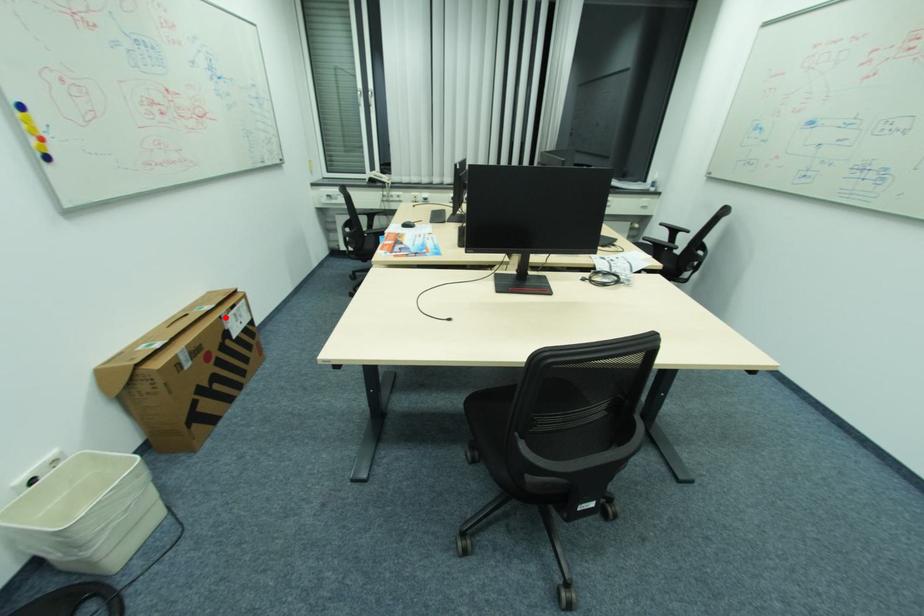
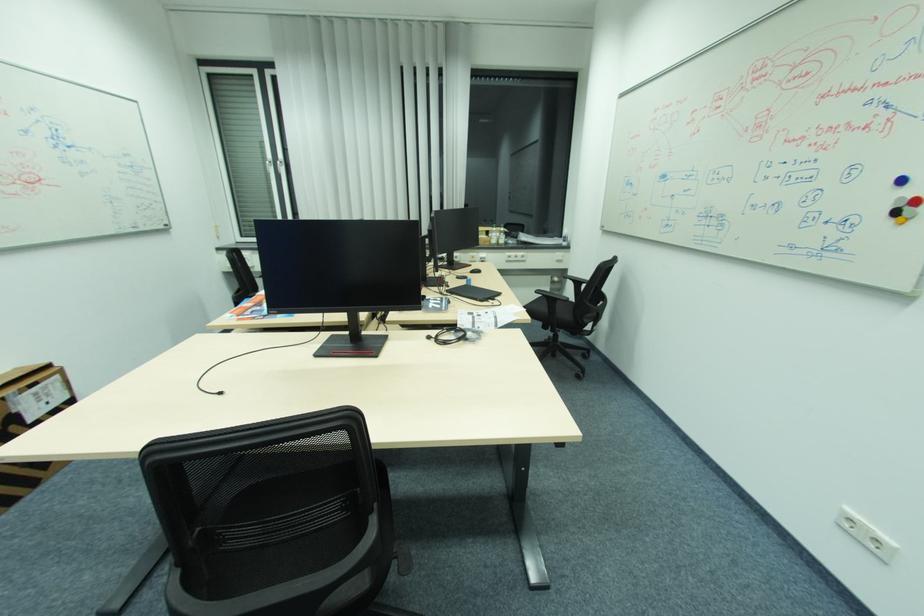
Question: I am providing you with two images of the same scene from different viewpoints. In image1, a red point is highlighted. Considering the same 3D point in image2, which of the following is correct?

Choices:
 (A) It is closer
 (B) It is farther

Answer: (B)